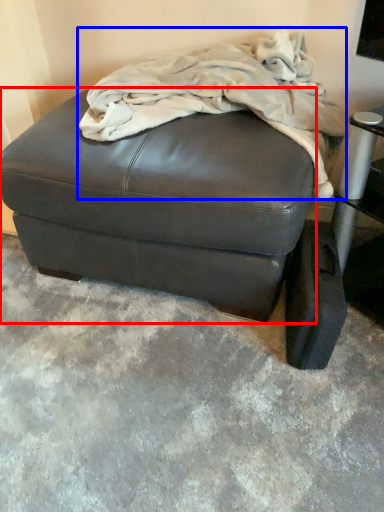
Question: Among these objects, which one is farthest to the camera, furniture (highlighted by a red box) or blanket (highlighted by a blue box)?

Choices:
 (A) furniture
 (B) blanket

Answer: (A)